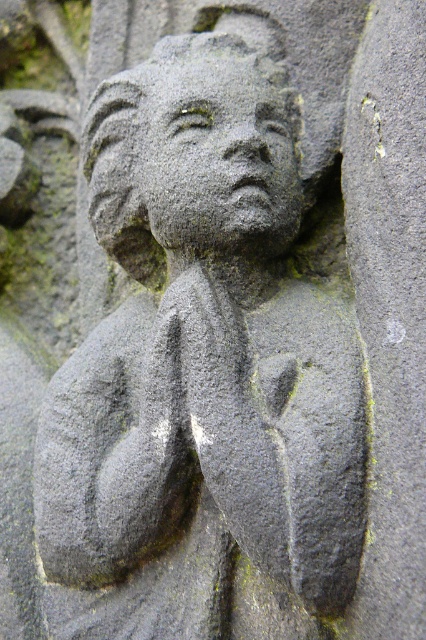
Question: From the image, what is the correct spatial relationship of gray stone head at center in relation to gray stone face at center?

Choices:
 (A) left
 (B) right

Answer: (A)

Question: Which object appears farthest from the camera in this image?

Choices:
 (A) gray stone face at center
 (B) gray stone head at center

Answer: (B)

Question: Considering the relative positions of gray stone head at center and gray stone face at center in the image provided, where is gray stone head at center located with respect to gray stone face at center?

Choices:
 (A) left
 (B) right

Answer: (A)

Question: Does gray stone head at center have a lesser width compared to gray stone face at center?

Choices:
 (A) yes
 (B) no

Answer: (B)